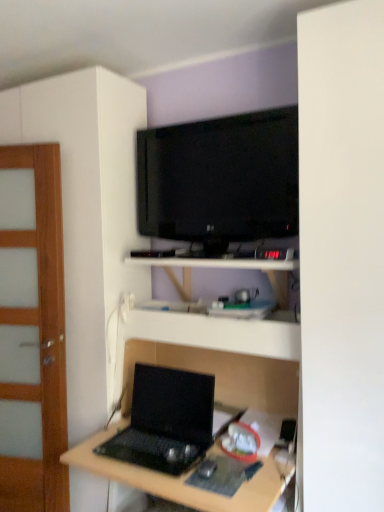
Where is `vacant area that is situated to the right of black plastic mouse at lower center`? The height and width of the screenshot is (512, 384). vacant area that is situated to the right of black plastic mouse at lower center is located at coordinates (230, 471).